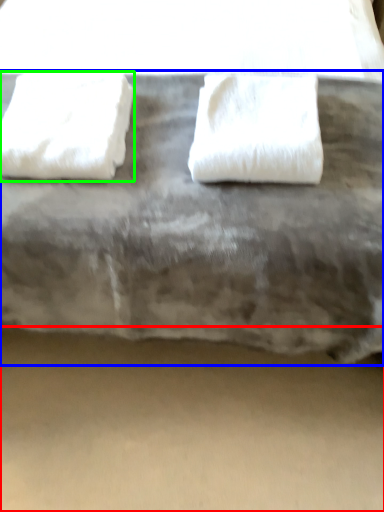
Question: Estimate the real-world distances between objects in this image. Which object is closer to concrete (highlighted by a red box), furniture (highlighted by a blue box) or towel (highlighted by a green box)?

Choices:
 (A) furniture
 (B) towel

Answer: (A)